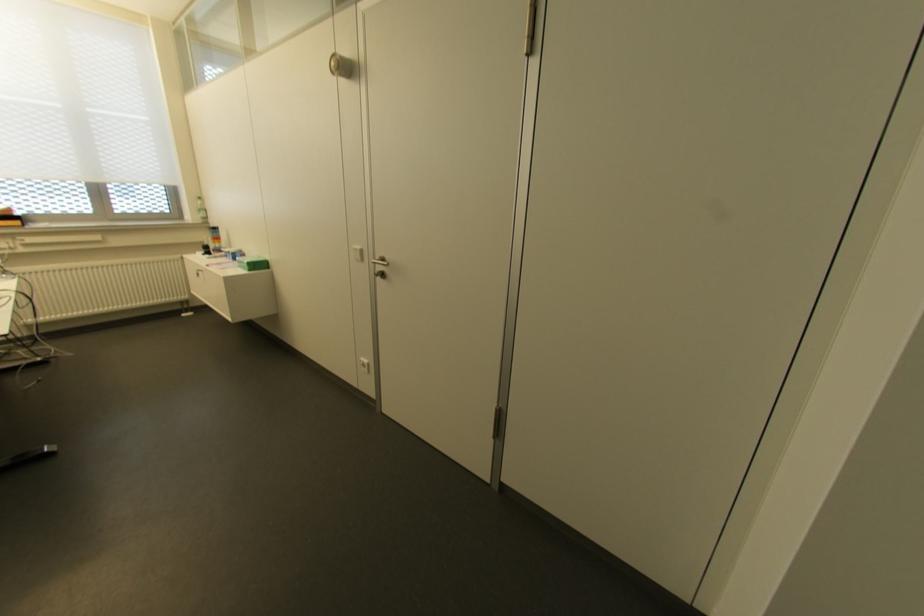
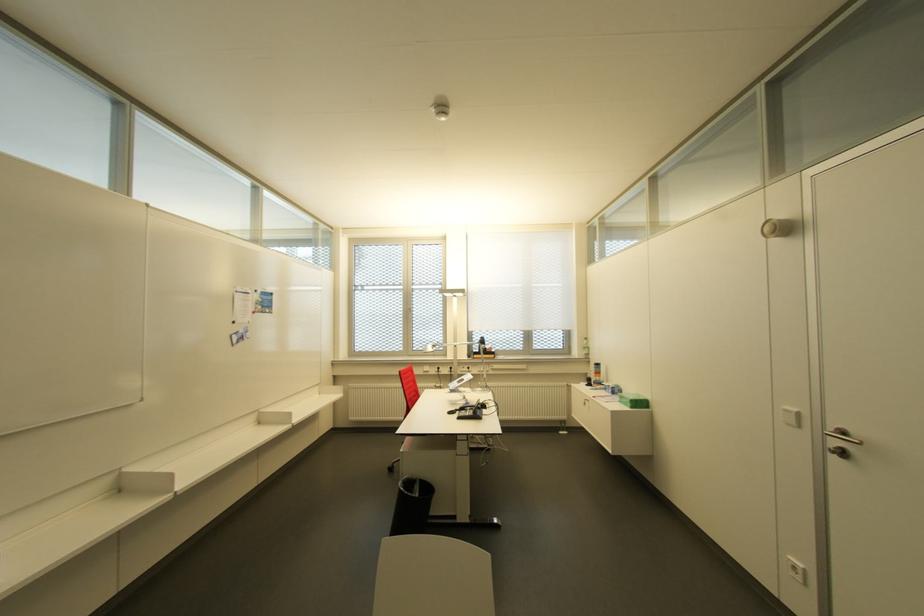
Question: The images are taken continuously from a first-person perspective. In which direction is your viewpoint rotating?

Choices:
 (A) Left
 (B) Right
 (C) Up
 (D) Down

Answer: (A)